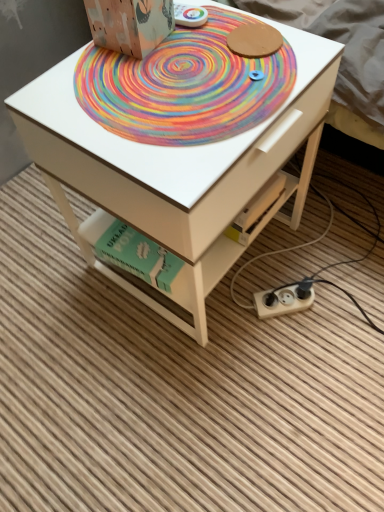
Image resolution: width=384 pixels, height=512 pixels. Find the location of `free space in front of white matte table at center`. free space in front of white matte table at center is located at coordinates (211, 399).